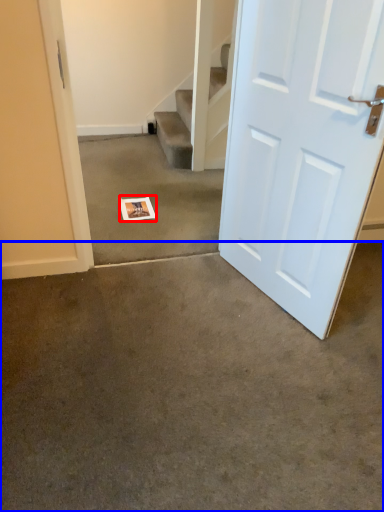
Question: Which of the following is the closest to the observer, postcard (highlighted by a red box) or concrete (highlighted by a blue box)?

Choices:
 (A) postcard
 (B) concrete

Answer: (B)